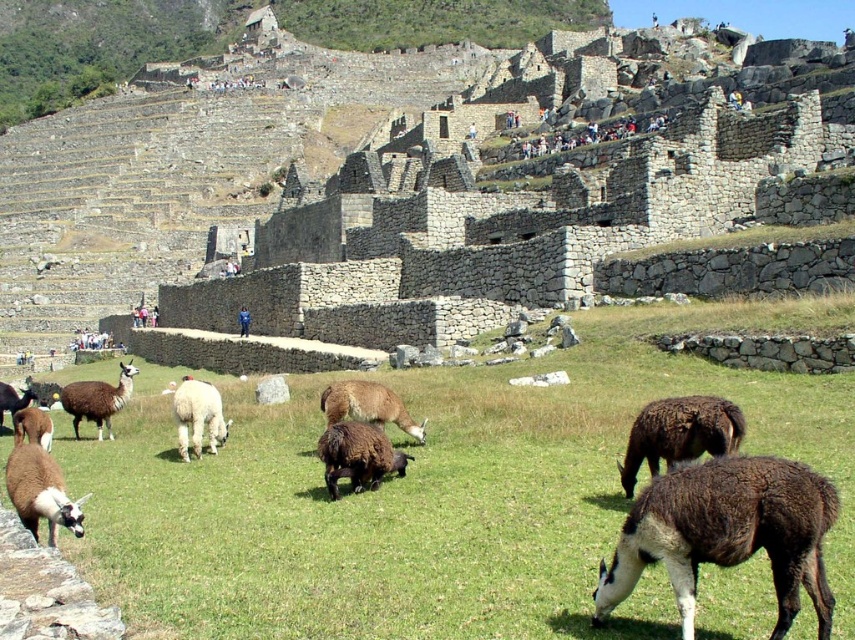
Who is lower down, white woolen alpaca at lower left or white woolen alpaca at center?

Positioned lower is white woolen alpaca at lower left.

From the picture: Between white woolen alpaca at lower left and white woolen alpaca at center, which one has more height?

With more height is white woolen alpaca at center.

Who is more distant from viewer, (31, 529) or (199, 419)?

The point (199, 419) is behind.

Locate an element on the screen. white woolen alpaca at lower left is located at coordinates (40, 492).

Between green grassy field at center and brown woolly alpaca at center, which one has less height?

Standing shorter between the two is brown woolly alpaca at center.

Which is more to the right, green grassy field at center or brown woolly alpaca at center?

Positioned to the right is brown woolly alpaca at center.

Locate an element on the screen. This screenshot has width=855, height=640. green grassy field at center is located at coordinates (434, 492).

Who is positioned more to the left, brown woolly llama at center-right or brown woolen sheep at center?

brown woolen sheep at center is more to the left.

Is point (656, 460) less distant than point (343, 467)?

That is True.

Locate an element on the screen. brown woolly llama at center-right is located at coordinates (679, 433).